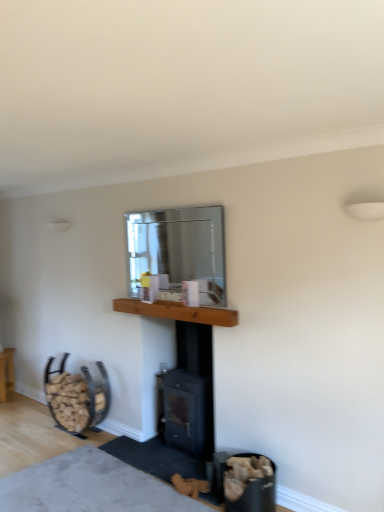
Identify the location of free spot above clear glass mirror at upper center (from a real-world perspective). The image size is (384, 512). (174, 204).